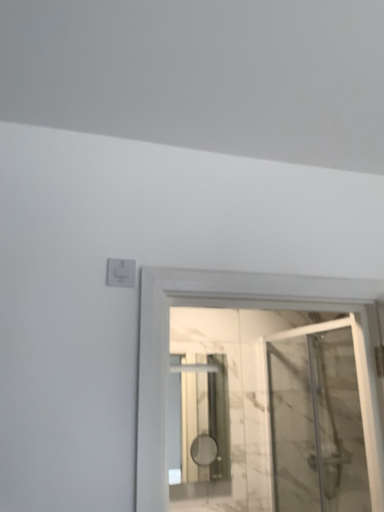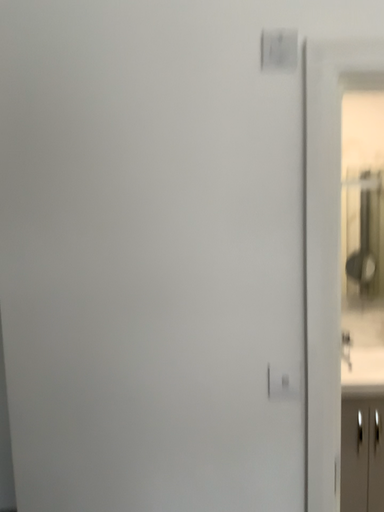
Question: Which way did the camera rotate in the video?

Choices:
 (A) rotated downward
 (B) rotated upward

Answer: (A)